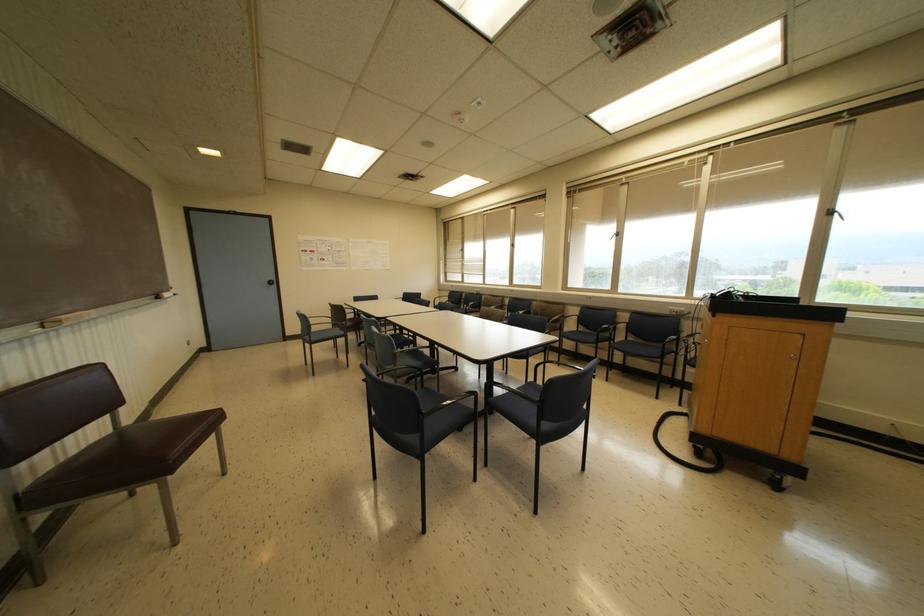
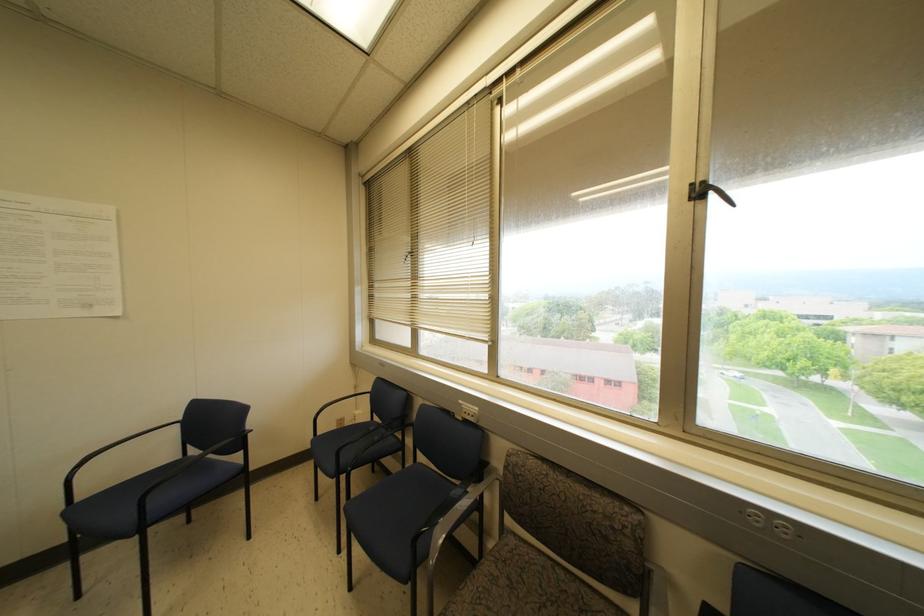
Question: Which direction would the cameraman need to move to produce the second image? Reply with the corresponding letter.

Choices:
 (A) Left
 (B) Right
 (C) Forward
 (D) Backward

Answer: (C)